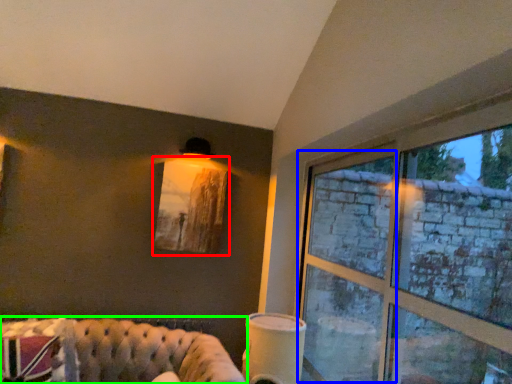
Question: Which object is positioned farthest from picture frame (highlighted by a red box)? Select from window frame (highlighted by a blue box) and studio couch (highlighted by a green box).

Choices:
 (A) window frame
 (B) studio couch

Answer: (A)